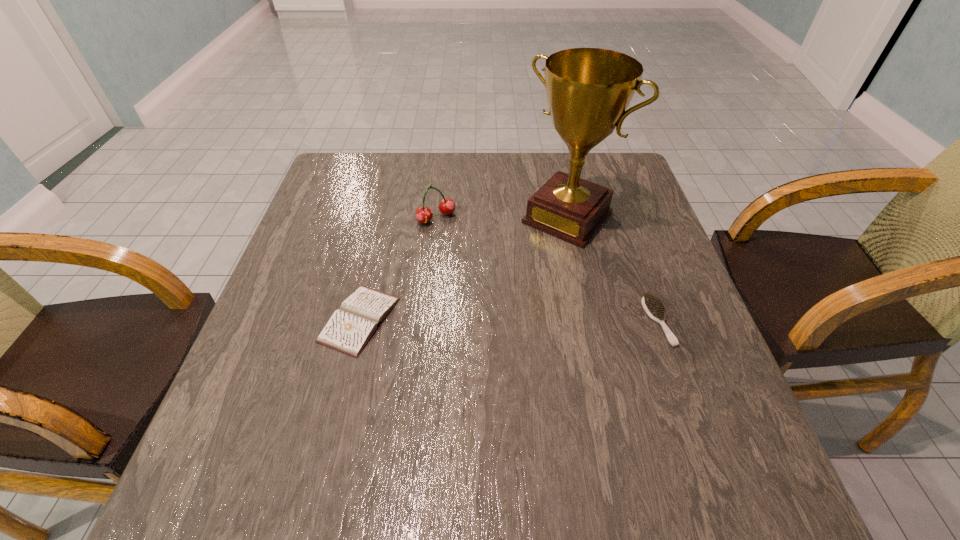
Identify the location of the shortest object. This screenshot has height=540, width=960. (351, 326).

Image resolution: width=960 pixels, height=540 pixels. Find the location of `diary`. diary is located at coordinates (351, 326).

I want to click on scrubbing brush, so click(x=652, y=304).

The height and width of the screenshot is (540, 960). I want to click on award, so click(588, 90).

Where is `cherry`? This screenshot has height=540, width=960. cherry is located at coordinates (446, 206).

In order to click on the third shortest object in this screenshot , I will do `click(446, 206)`.

The height and width of the screenshot is (540, 960). In order to click on free space located 0.360m on the back of the leftmost object in this screenshot , I will do click(391, 192).

Locate an element on the screen. The height and width of the screenshot is (540, 960). vacant space located 0.320m on the back of the third tallest object is located at coordinates (617, 208).

Locate an element on the screen. vacant point located on the plaque of the tallest object is located at coordinates (518, 271).

You are a GUI agent. You are given a task and a screenshot of the screen. Output one action in this format:
    pyautogui.click(x=<x>, y=<y>)
    Task: Click on the free location located 0.070m on the plaque of the tallest object
    Image resolution: width=960 pixels, height=540 pixels.
    Given the screenshot: What is the action you would take?
    pyautogui.click(x=530, y=259)